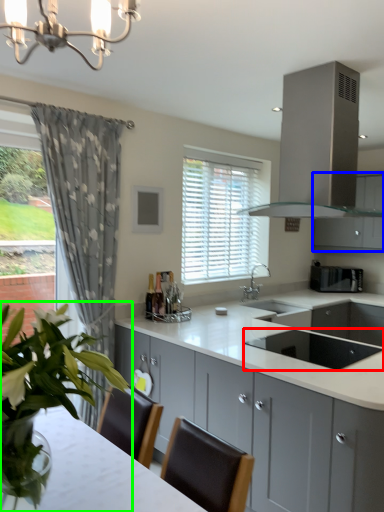
Question: Which is nearer to the appliance (highlighted by a red box)? cabinetry (highlighted by a blue box) or houseplant (highlighted by a green box).

Choices:
 (A) cabinetry
 (B) houseplant

Answer: (B)